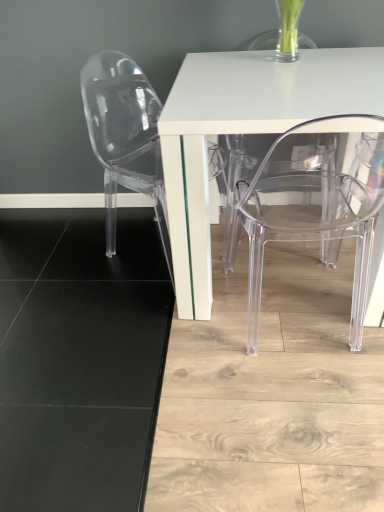
Locate an element on the screen. Image resolution: width=384 pixels, height=512 pixels. free space in front of transparent plastic chair at left, arranged as the second chair when viewed from the right is located at coordinates (135, 321).